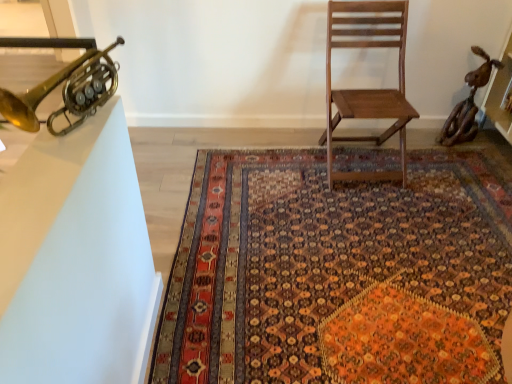
Locate an element on the screen. This screenshot has height=384, width=512. free location in front of gold brass trumpet at upper left is located at coordinates (41, 178).